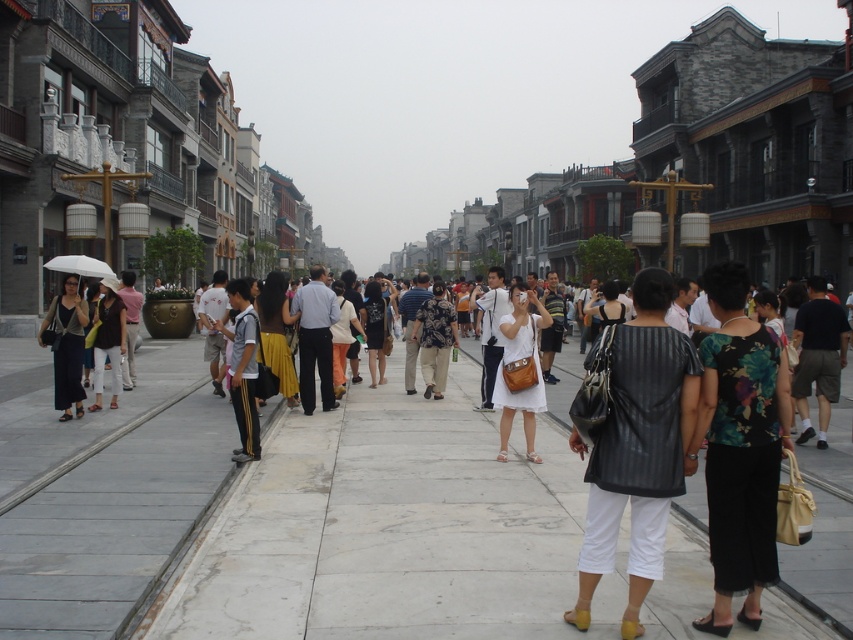
Is black leather vest at center below white matte dress at center?

Yes, black leather vest at center is below white matte dress at center.

Does black leather vest at center have a smaller size compared to white matte dress at center?

Correct, black leather vest at center occupies less space than white matte dress at center.

Which is behind, point (651, 472) or point (521, 337)?

The point (521, 337) is more distant.

Find the location of `black leather vest at center`. black leather vest at center is located at coordinates (637, 449).

Can you confirm if floral fabric blouse at center is taller than gray fabric shirt at center?

In fact, floral fabric blouse at center may be shorter than gray fabric shirt at center.

Locate an element on the screen. The height and width of the screenshot is (640, 853). floral fabric blouse at center is located at coordinates (740, 448).

Image resolution: width=853 pixels, height=640 pixels. What do you see at coordinates (637, 449) in the screenshot? I see `black leather vest at center` at bounding box center [637, 449].

Does black leather vest at center come in front of matte black umbrella at left?

Yes, it is in front of matte black umbrella at left.

What do you see at coordinates (637, 449) in the screenshot? I see `black leather vest at center` at bounding box center [637, 449].

What are the coordinates of `black leather vest at center` in the screenshot? It's located at (637, 449).